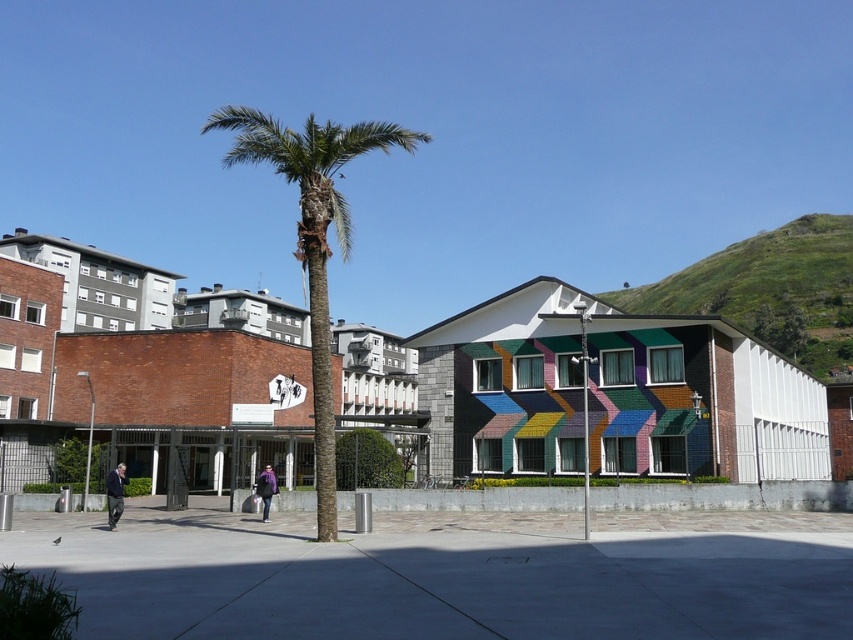
You are a delivery person who needs to place a package on the smooth concrete pavement at center. However, there is a purple fabric bag at center in the way. Can you place the package there without moving the bag?

The smooth concrete pavement at center has a larger size compared to purple fabric bag at center, so yes, you can place the package there without moving the bag since there is enough space available.

You are a delivery person who needs to place a purple fabric bag at center on the ground without damaging the green leafy palm tree at center. Is there enough vertical space between them to do this?

The green leafy palm tree at center is above the purple fabric bag at center, so placing the bag on the ground would be possible as long as it doesn not touch the tree. The vertical space exists between them.